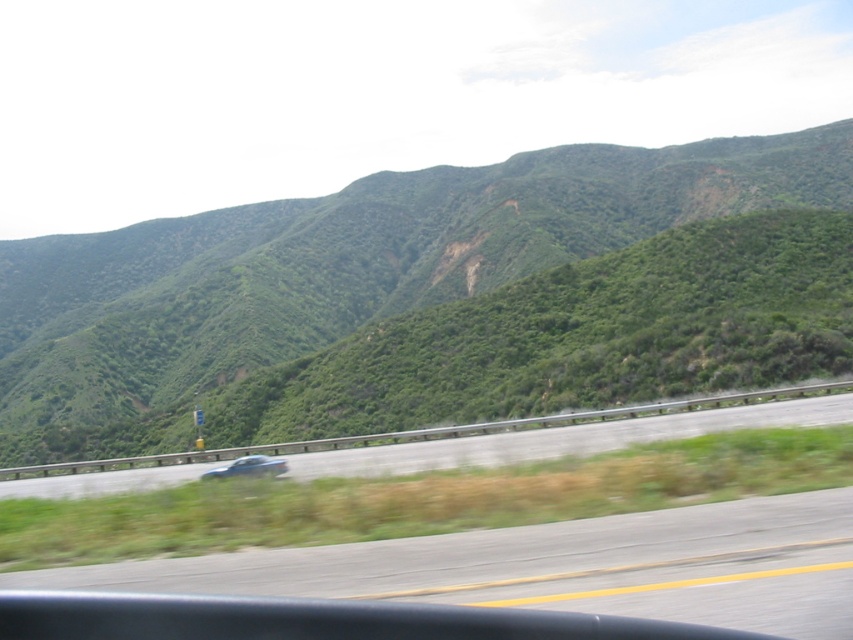
You are a passenger in the metallic blue sedan at center. Looking out the window, you notice the green leafy hillside at center. Based on the scene, which object is closer to you?

The metallic blue sedan at center is closer to you because you are inside it, while the green leafy hillside at center is part of the landscape in the distance.